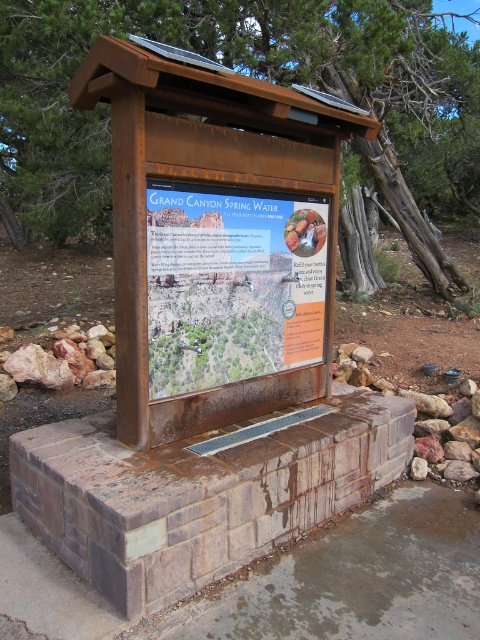
Is rusty wood sign at upper center in front of rustic wood sign at center?

That is False.

Does rusty wood sign at upper center have a smaller size compared to rustic wood sign at center?

Incorrect, rusty wood sign at upper center is not smaller in size than rustic wood sign at center.

What are the coordinates of `rusty wood sign at upper center` in the screenshot? It's located at (262, 77).

Is rusty wood sign at upper center smaller than rusty wood sign at center?

No.

Is point (78, 136) more distant than point (225, 147)?

Yes.

Does point (471, 104) lie in front of point (319, 346)?

No, it is not.

You are a GUI agent. You are given a task and a screenshot of the screen. Output one action in this format:
    pyautogui.click(x=<x>, y=<y>)
    Task: Click on the rusty wood sign at upper center
    
    Given the screenshot: What is the action you would take?
    pyautogui.click(x=262, y=77)

Which of these two, rusty wood sign at center or rustic wood sign at center, stands taller?

With more height is rusty wood sign at center.

Can you confirm if rusty wood sign at center is wider than rustic wood sign at center?

Indeed, rusty wood sign at center has a greater width compared to rustic wood sign at center.

Is point (266, 124) closer to camera compared to point (223, 196)?

No, it is not.

This screenshot has width=480, height=640. I want to click on rusty wood sign at center, so click(x=208, y=188).